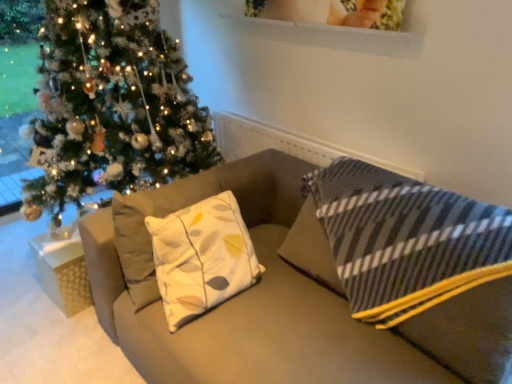
Question: From the image's perspective, is matte beige couch at center located beneath white textured gift box at lower left?

Choices:
 (A) no
 (B) yes

Answer: (A)

Question: Does matte beige couch at center appear on the right side of white textured gift box at lower left?

Choices:
 (A) yes
 (B) no

Answer: (A)

Question: Considering the relative sizes of matte beige couch at center and white textured gift box at lower left in the image provided, is matte beige couch at center smaller than white textured gift box at lower left?

Choices:
 (A) no
 (B) yes

Answer: (A)

Question: From a real-world perspective, is matte beige couch at center physically above white textured gift box at lower left?

Choices:
 (A) yes
 (B) no

Answer: (A)

Question: Is matte beige couch at center at the left side of white textured gift box at lower left?

Choices:
 (A) no
 (B) yes

Answer: (A)

Question: Is matte beige couch at center facing towards white textured gift box at lower left?

Choices:
 (A) yes
 (B) no

Answer: (B)

Question: Could you tell me if shiny green christmas tree at left is facing white textured gift box at lower left?

Choices:
 (A) no
 (B) yes

Answer: (B)

Question: Is shiny green christmas tree at left placed right next to white textured gift box at lower left?

Choices:
 (A) no
 (B) yes

Answer: (A)

Question: From a real-world perspective, is shiny green christmas tree at left on top of white textured gift box at lower left?

Choices:
 (A) no
 (B) yes

Answer: (B)

Question: Does shiny green christmas tree at left lie behind white textured gift box at lower left?

Choices:
 (A) no
 (B) yes

Answer: (A)

Question: Does shiny green christmas tree at left contain white textured gift box at lower left?

Choices:
 (A) no
 (B) yes

Answer: (B)

Question: From the image's perspective, is shiny green christmas tree at left above white textured gift box at lower left?

Choices:
 (A) yes
 (B) no

Answer: (A)

Question: Is shiny green christmas tree at left next to matte beige couch at center?

Choices:
 (A) yes
 (B) no

Answer: (B)